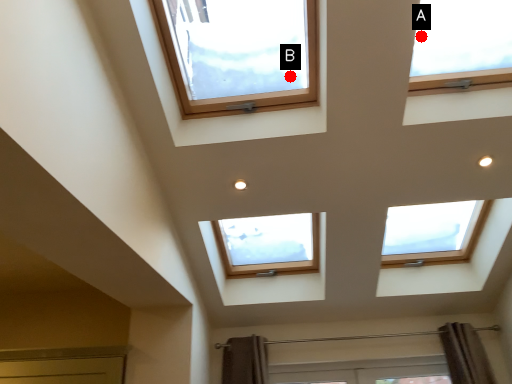
Question: Two points are circled on the image, labeled by A and B beside each circle. Which point is further to the camera?

Choices:
 (A) A is further
 (B) B is further

Answer: (B)